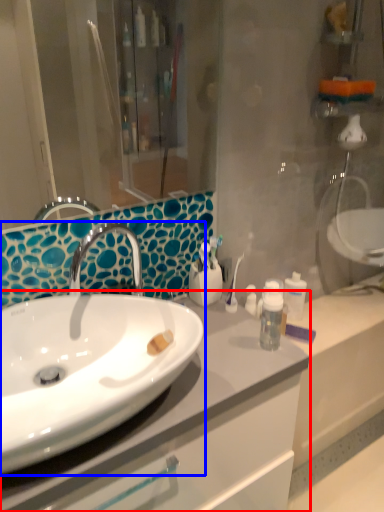
Question: Which point is further to the camera, bathroom cabinet (highlighted by a red box) or sink (highlighted by a blue box)?

Choices:
 (A) bathroom cabinet
 (B) sink

Answer: (A)